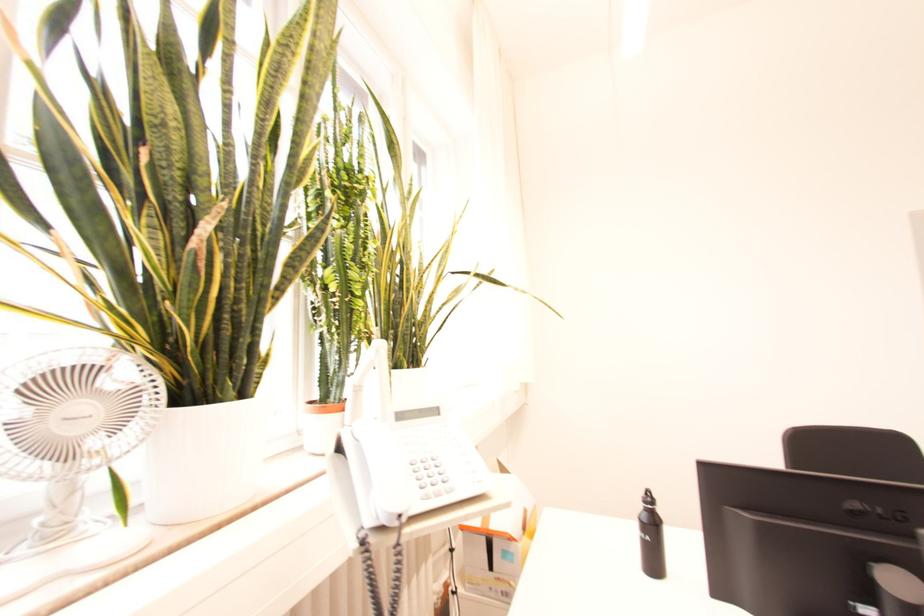
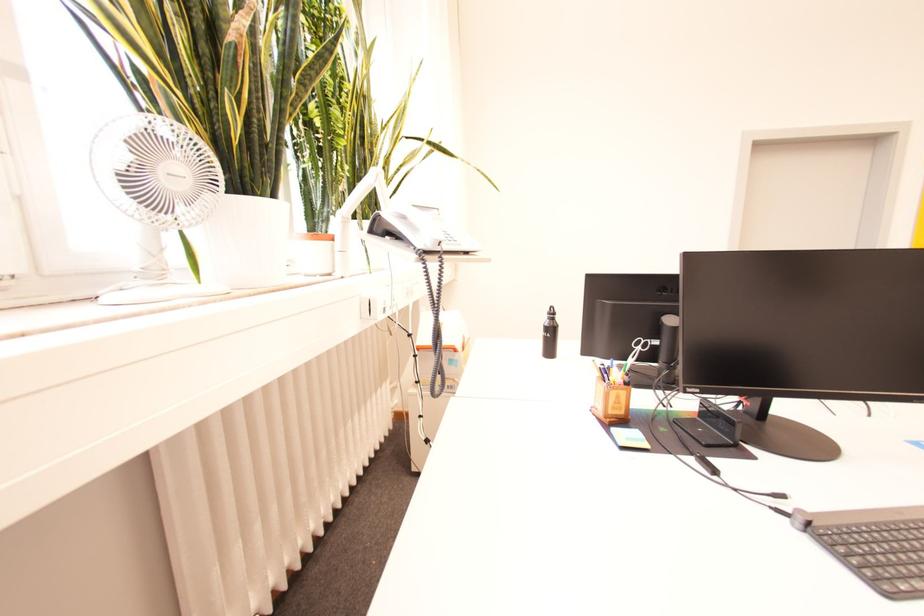
Find the pixel in the second image that matches pixel 650 543 in the first image.

(553, 339)